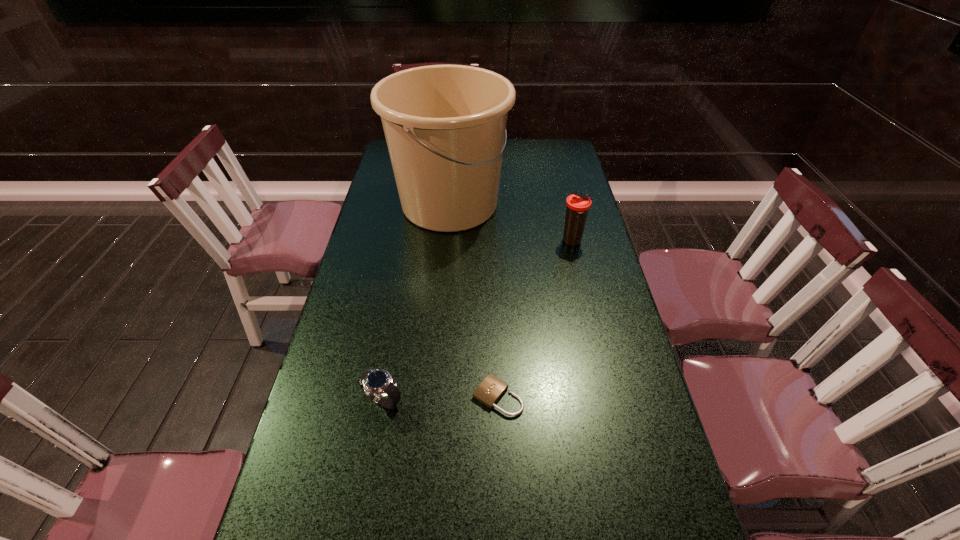
Find the location of a particular element. watch that is at the left edge is located at coordinates (378, 384).

The image size is (960, 540). Identify the location of object that is at the right edge. (578, 204).

The image size is (960, 540). Identify the location of vacant space at the far edge of the desktop. click(531, 144).

The height and width of the screenshot is (540, 960). Find the location of `vacant area at the left edge of the desktop`. vacant area at the left edge of the desktop is located at coordinates (388, 250).

At what (x,y) coordinates should I click in order to perform the action: click on free region at the right edge of the desktop. Please return your answer as a coordinate pair (x, y). This screenshot has height=540, width=960. Looking at the image, I should click on (574, 296).

Where is `free spot between the tallest object and the thermos bottle`? free spot between the tallest object and the thermos bottle is located at coordinates (511, 223).

This screenshot has width=960, height=540. What are the coordinates of `vacant space that's between the shortest object and the bucket` in the screenshot? It's located at (474, 300).

At what (x,y) coordinates should I click in order to perform the action: click on empty space that is in between the second tallest object and the padlock. Please return your answer as a coordinate pair (x, y). The width and height of the screenshot is (960, 540). Looking at the image, I should click on (536, 319).

Identify the location of free point between the thermos bottle and the watch. (478, 321).

Locate an element on the screen. This screenshot has height=540, width=960. free space between the bucket and the third tallest object is located at coordinates (417, 302).